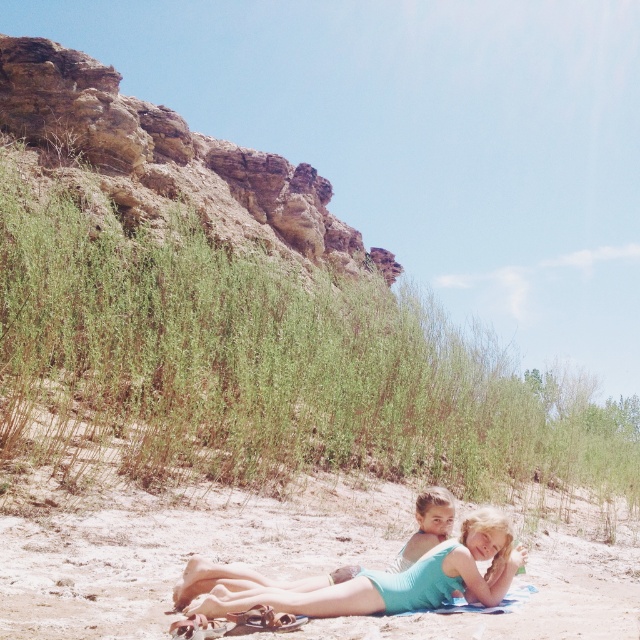
You are a photographer planning to take a photo of both the rustic stone cliff at upper left and the teal fabric swimsuit at lower center in the scene. Given that your camera has a maximum focus range of 200 feet, will you be able to capture both subjects in sharp focus at the same time?

The rustic stone cliff at upper left and the teal fabric swimsuit at lower center are 291.04 feet apart from each other. Since the distance exceeds the camera maximum focus range of 200 feet, you cannot capture both subjects in sharp focus at the same time.

You are standing at the point marked as point (134, 173) on a beach. You want to take a photo of the cliff in the background using a camera that has a maximum zoom range of 100 meters. Can you capture the cliff in your photo without moving the camera?

The distance between point (134, 173) and the camera is 141.24 meters. Since the camera can only zoom up to 100 meters, it cannot capture the cliff at this distance. You would need to move closer or use a camera with a longer zoom range.